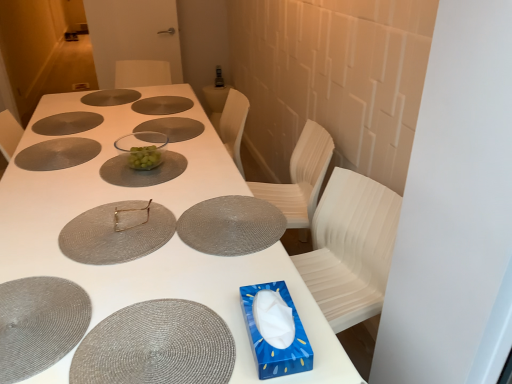
The image size is (512, 384). I want to click on free spot above matte gray glass plate at upper center, which is the 9th glass plate from front to back (from a real-world perspective), so click(106, 92).